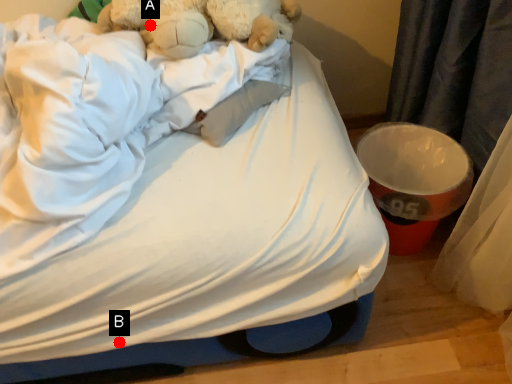
Question: Two points are circled on the image, labeled by A and B beside each circle. Which of the following is the closest to the observer?

Choices:
 (A) A is closer
 (B) B is closer

Answer: (B)